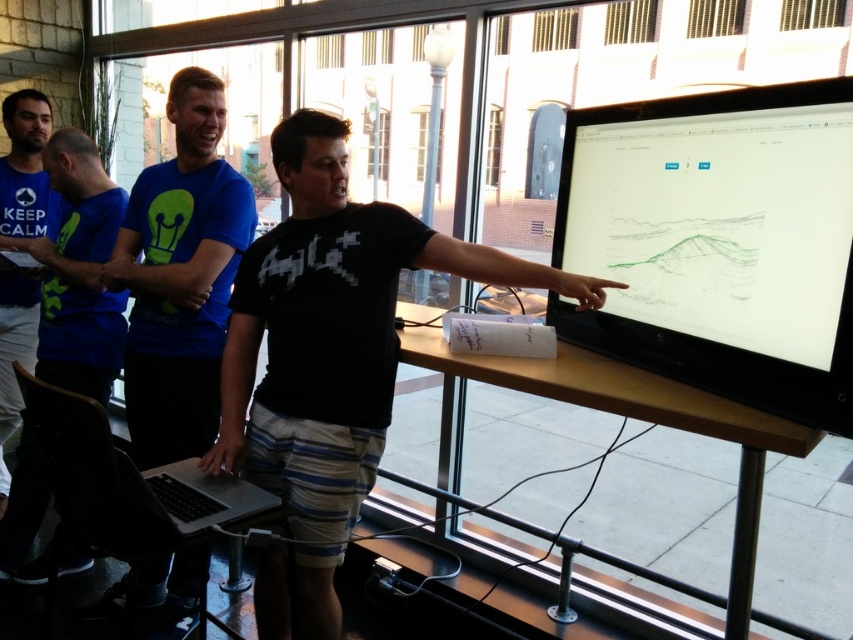
You are standing in the office scene. There is a point marked at coordinates (x=608, y=412). What object is this point located on?

The point at coordinates (x=608, y=412) is located on the wooden table at center.

You are part of the group at the table. You need to pass a pen from the wooden at center to the blue matte shirt at center. Which direction should you move the pen?

The blue matte shirt at center is to the left of wooden at center, so you should move the pen to the left.